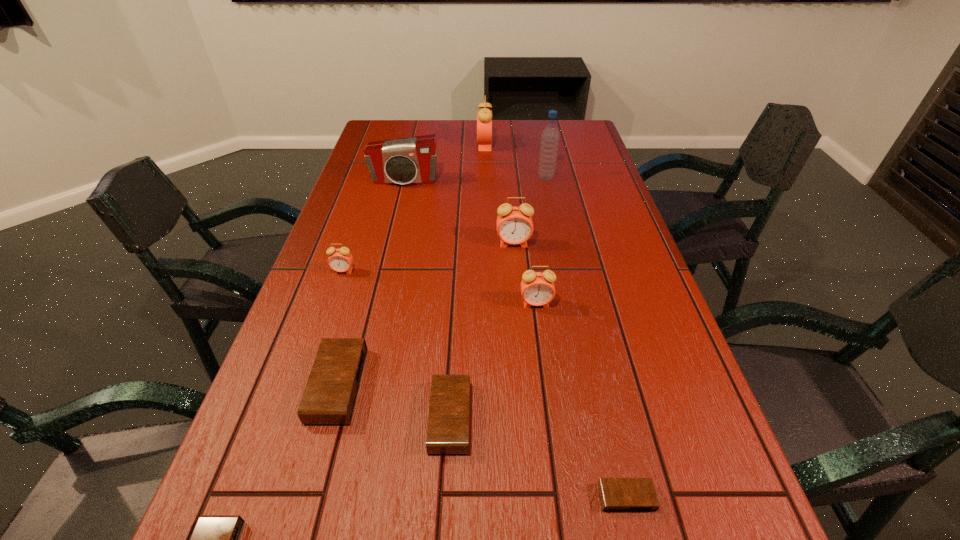
Locate an element on the screen. free spot located 0.400m on the face of the farthest pink alarm clock is located at coordinates (372, 145).

Where is `vacant position located 0.110m on the front-facing side of the camera`? vacant position located 0.110m on the front-facing side of the camera is located at coordinates (398, 208).

You are a GUI agent. You are given a task and a screenshot of the screen. Output one action in this format:
    pyautogui.click(x=<x>, y=<y>)
    Task: Click on the free spot located 0.090m on the face of the fourth farthest object
    The width and height of the screenshot is (960, 540).
    Given the screenshot: What is the action you would take?
    pyautogui.click(x=516, y=270)

The image size is (960, 540). I want to click on vacant area situated on the face of the fifth tallest object, so click(x=540, y=339).

The image size is (960, 540). Identify the location of vacant space located 0.390m on the face of the fifth shortest object. click(x=297, y=409).

What are the coordinates of `vacant space located on the front face of the third black alarm clock from right to left` in the screenshot? It's located at (531, 385).

Where is `vacant space located on the front face of the second black alarm clock from right to left`? vacant space located on the front face of the second black alarm clock from right to left is located at coordinates (599, 417).

You are a GUI agent. You are given a task and a screenshot of the screen. Output one action in this format:
    pyautogui.click(x=<x>, y=<y>)
    Task: Click on the object located in the far edge section of the desktop
    This screenshot has height=540, width=960.
    Given the screenshot: What is the action you would take?
    pyautogui.click(x=484, y=116)

In order to click on camera at the left edge in this screenshot , I will do `click(412, 160)`.

In order to click on object at the right edge in this screenshot , I will do `click(616, 494)`.